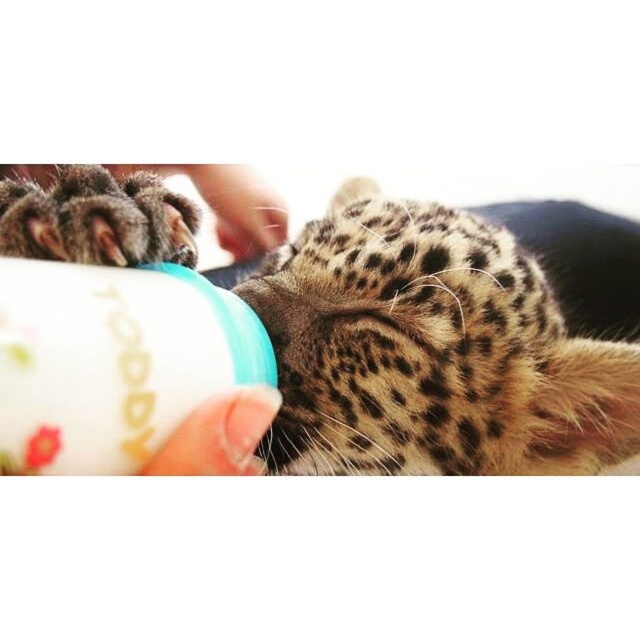
Question: Which point is closer to the camera?

Choices:
 (A) (332, 269)
 (B) (108, 285)

Answer: (B)

Question: Is spotted fur leopard at center behind white plastic bottle at center?

Choices:
 (A) yes
 (B) no

Answer: (A)

Question: Is spotted fur leopard at center behind white plastic bottle at center?

Choices:
 (A) yes
 (B) no

Answer: (A)

Question: Which of the following is the closest to the observer?

Choices:
 (A) (35, 339)
 (B) (548, 433)

Answer: (A)

Question: Does spotted fur leopard at center appear over white plastic bottle at center?

Choices:
 (A) yes
 (B) no

Answer: (B)

Question: Which object is closer to the camera taking this photo?

Choices:
 (A) spotted fur leopard at center
 (B) white plastic bottle at center

Answer: (B)